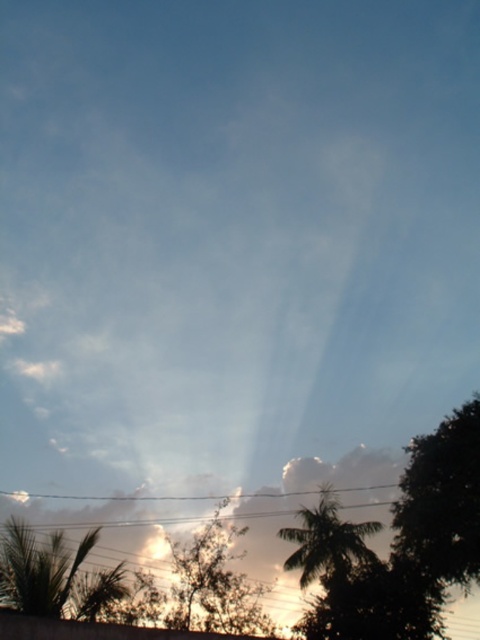
Question: Among these points, which one is farthest from the camera?

Choices:
 (A) 455,445
 (B) 310,528

Answer: (B)

Question: Which point appears farthest from the camera in this image?

Choices:
 (A) (465, 412)
 (B) (315, 516)

Answer: (B)

Question: Estimate the real-world distances between objects in this image. Which object is farther from the green leafy tree at right?

Choices:
 (A) green leafy tree at center
 (B) silhouette leafy palm at lower right

Answer: (A)

Question: Is green leafy tree at right to the right of green leafy tree at center from the viewer's perspective?

Choices:
 (A) yes
 (B) no

Answer: (A)

Question: Can you confirm if green leafy tree at right is bigger than green leafy tree at center?

Choices:
 (A) no
 (B) yes

Answer: (A)

Question: Is green leafy tree at right positioned behind green leafy tree at center?

Choices:
 (A) no
 (B) yes

Answer: (A)